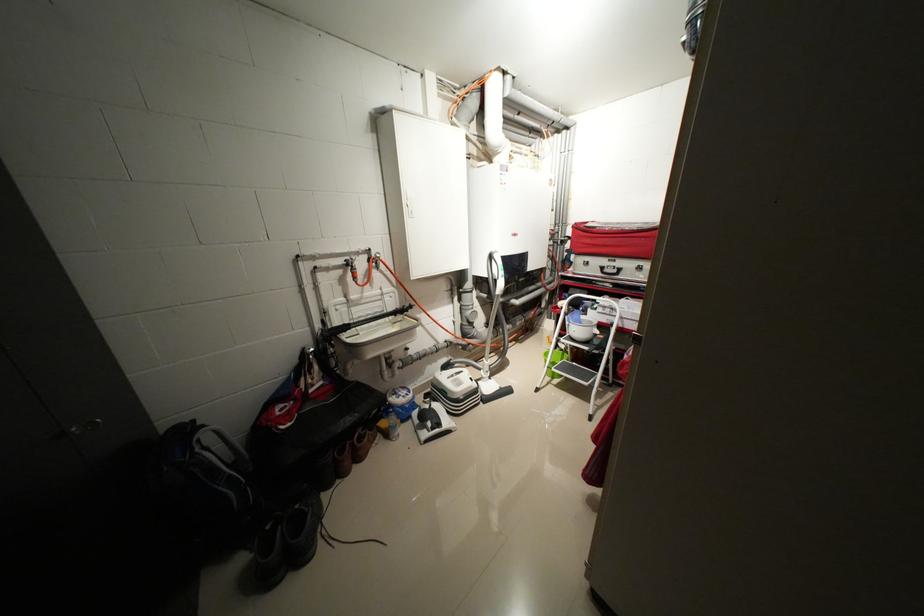
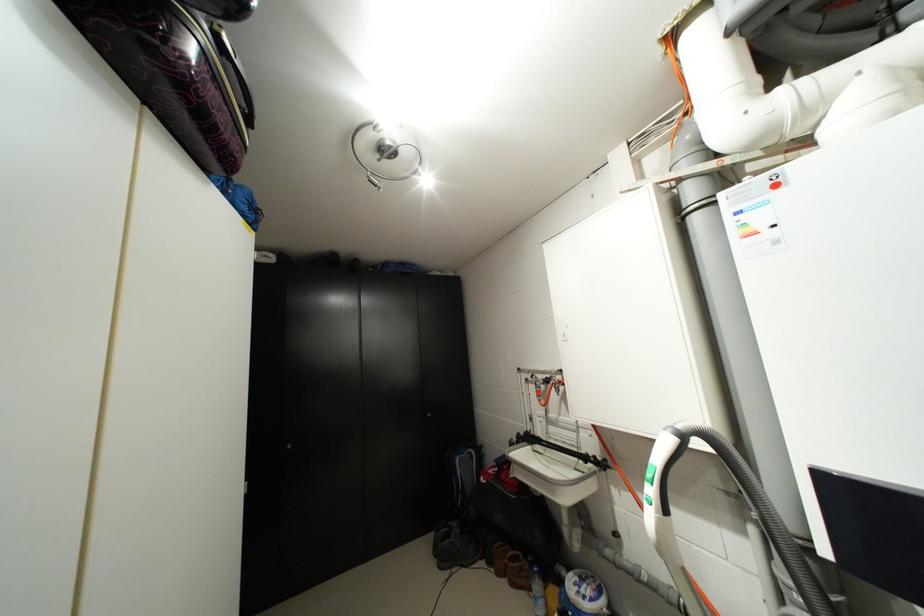
Where in the second image is the point corresponding to pixel 417 392 from the first image?

(599, 600)